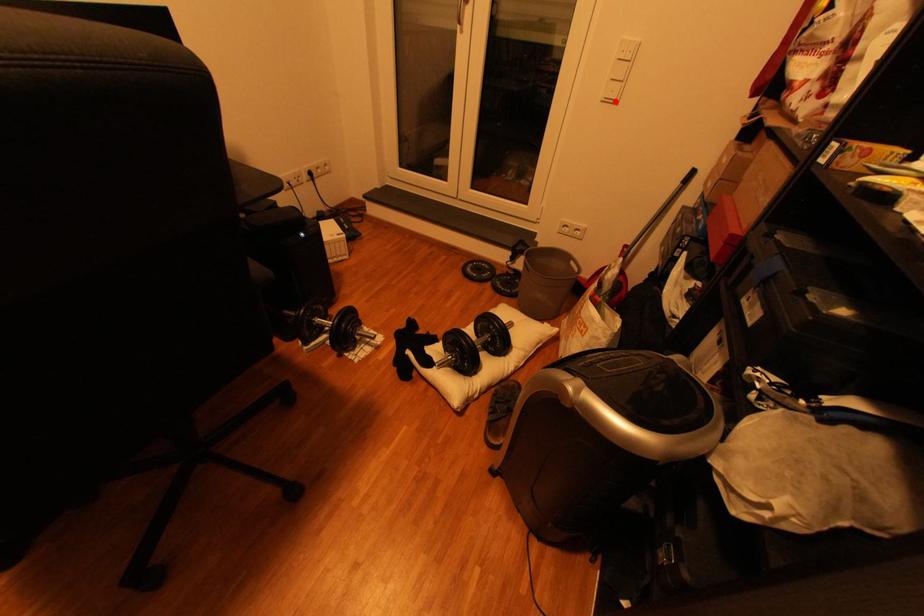
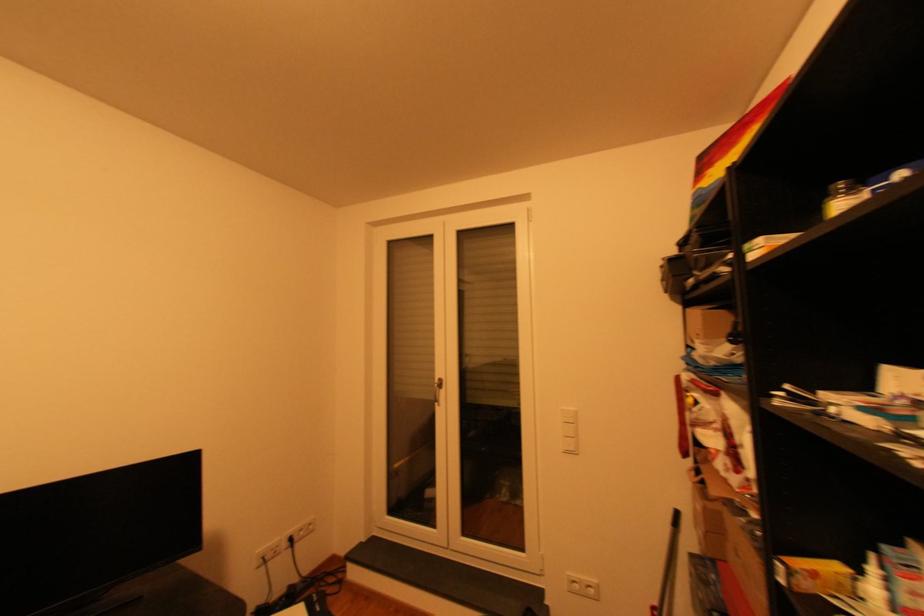
The point at the highlighted location is marked in the first image. Where is the corresponding point in the second image?

(576, 453)